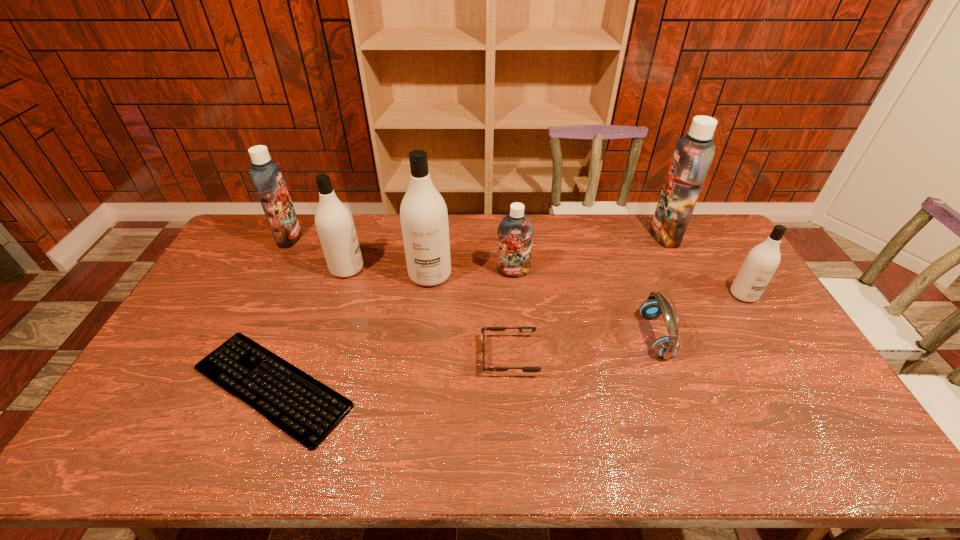
Locate an element on the screen. the rightmost shampoo is located at coordinates (762, 261).

I want to click on the rightmost white shampoo, so click(762, 261).

Image resolution: width=960 pixels, height=540 pixels. In order to click on the third object from right to left in this screenshot , I will do `click(654, 306)`.

Where is `blue headset`? blue headset is located at coordinates (654, 306).

Identify the location of sunglasses. The image size is (960, 540). coord(522,329).

Where is `black computer keyboard`? black computer keyboard is located at coordinates (305, 409).

What are the coordinates of `computer keyboard` in the screenshot? It's located at (305, 409).

Find the location of a particular element. The height and width of the screenshot is (540, 960). free space located on the front label of the rightmost blue shampoo is located at coordinates (574, 235).

Locate an element on the screen. free space located on the front label of the rightmost blue shampoo is located at coordinates (548, 235).

This screenshot has width=960, height=540. Find the location of `vacant space situated 0.280m on the front label of the rightmost blue shampoo`. vacant space situated 0.280m on the front label of the rightmost blue shampoo is located at coordinates (577, 235).